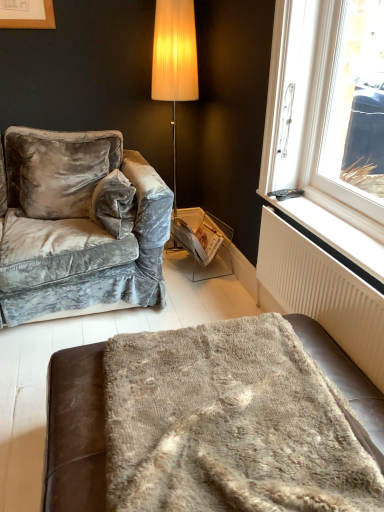
Question: Is white plastic radiator at lower right to the left of fuzzy beige blanket at lower center from the viewer's perspective?

Choices:
 (A) yes
 (B) no

Answer: (B)

Question: Can you confirm if white plastic radiator at lower right is smaller than fuzzy beige blanket at lower center?

Choices:
 (A) no
 (B) yes

Answer: (B)

Question: From a real-world perspective, is white plastic radiator at lower right below fuzzy beige blanket at lower center?

Choices:
 (A) yes
 (B) no

Answer: (B)

Question: Is fuzzy beige blanket at lower center located within white plastic radiator at lower right?

Choices:
 (A) no
 (B) yes

Answer: (A)

Question: Can you confirm if white plastic radiator at lower right is wider than fuzzy beige blanket at lower center?

Choices:
 (A) yes
 (B) no

Answer: (B)

Question: Can you confirm if white plastic radiator at lower right is thinner than fuzzy beige blanket at lower center?

Choices:
 (A) no
 (B) yes

Answer: (B)

Question: Does white plastic radiator at lower right appear on the right side of white textured radiator at lower right?

Choices:
 (A) yes
 (B) no

Answer: (A)

Question: Is white plastic radiator at lower right at the left side of white textured radiator at lower right?

Choices:
 (A) yes
 (B) no

Answer: (B)

Question: Considering the relative sizes of white plastic radiator at lower right and white textured radiator at lower right in the image provided, is white plastic radiator at lower right taller than white textured radiator at lower right?

Choices:
 (A) no
 (B) yes

Answer: (A)

Question: Could white textured radiator at lower right be considered to be inside white plastic radiator at lower right?

Choices:
 (A) no
 (B) yes

Answer: (A)

Question: Is white plastic radiator at lower right bigger than white textured radiator at lower right?

Choices:
 (A) yes
 (B) no

Answer: (B)

Question: Can you confirm if white plastic radiator at lower right is wider than white textured radiator at lower right?

Choices:
 (A) yes
 (B) no

Answer: (A)

Question: Could you tell me if white glossy magazine at center is facing velvet gray couch at left?

Choices:
 (A) no
 (B) yes

Answer: (A)